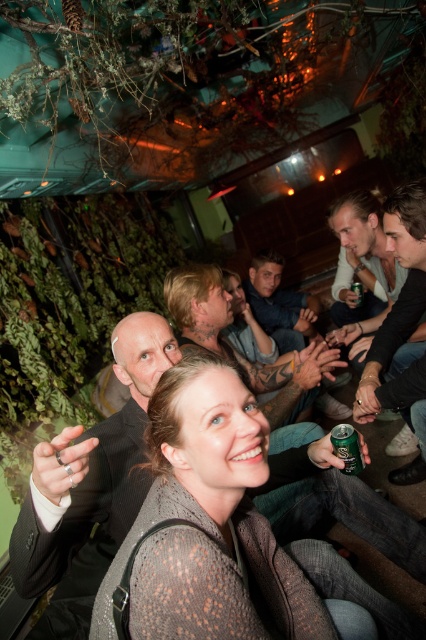
Question: Which point appears closest to the camera in this image?

Choices:
 (A) (249, 358)
 (B) (210, 314)
 (C) (409, 234)

Answer: (C)

Question: Where is denim shirt at center located in relation to smooth skin face at center in the image?

Choices:
 (A) right
 (B) left

Answer: (A)

Question: Does smooth black shirt at right appear over shiny silver necklace at center?

Choices:
 (A) no
 (B) yes

Answer: (B)

Question: In this image, where is knitted sweater at center located relative to denim shirt at center?

Choices:
 (A) above
 (B) below

Answer: (B)

Question: Which is nearer to the green metallic can at lower right?

Choices:
 (A) smooth skin face at center
 (B) knitted sweater at center

Answer: (B)

Question: Which point is closer to the camera?

Choices:
 (A) smooth skin face at center
 (B) green metallic can at lower right
 (C) smooth black shirt at right
 (D) knitted sweater at center

Answer: (D)